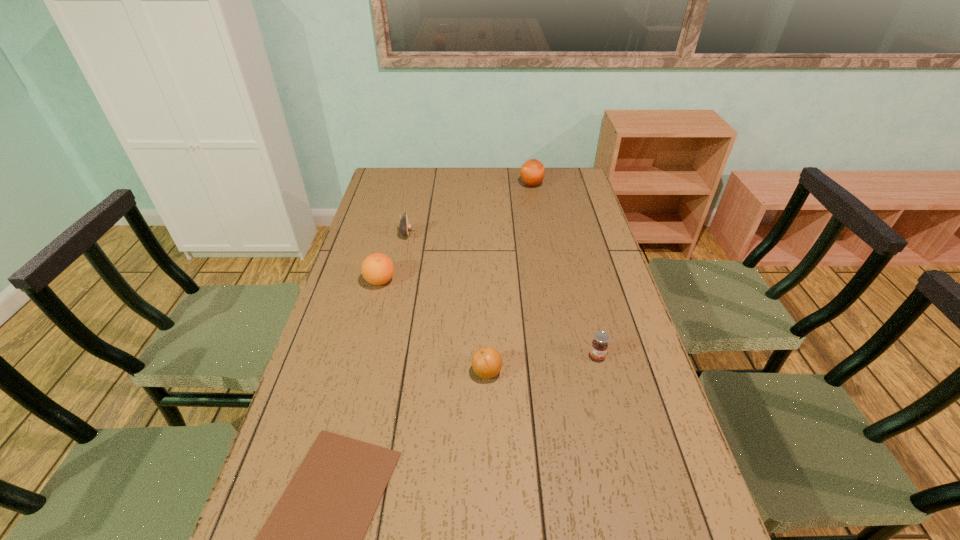
Point out which orange is positioned as the nearest to the farthest orange. Please provide its 2D coordinates. Your answer should be formatted as a tuple, i.e. [(x, y)], where the tuple contains the x and y coordinates of a point satisfying the conditions above.

[(377, 269)]

Where is `orange that is the closest to the second tallest orange`? This screenshot has width=960, height=540. orange that is the closest to the second tallest orange is located at coordinates (487, 362).

Image resolution: width=960 pixels, height=540 pixels. I want to click on free location that satisfies the following two spatial constraints: 1. on the seed side of the second farthest object; 2. on the right side of the second orange from left to right, so click(378, 372).